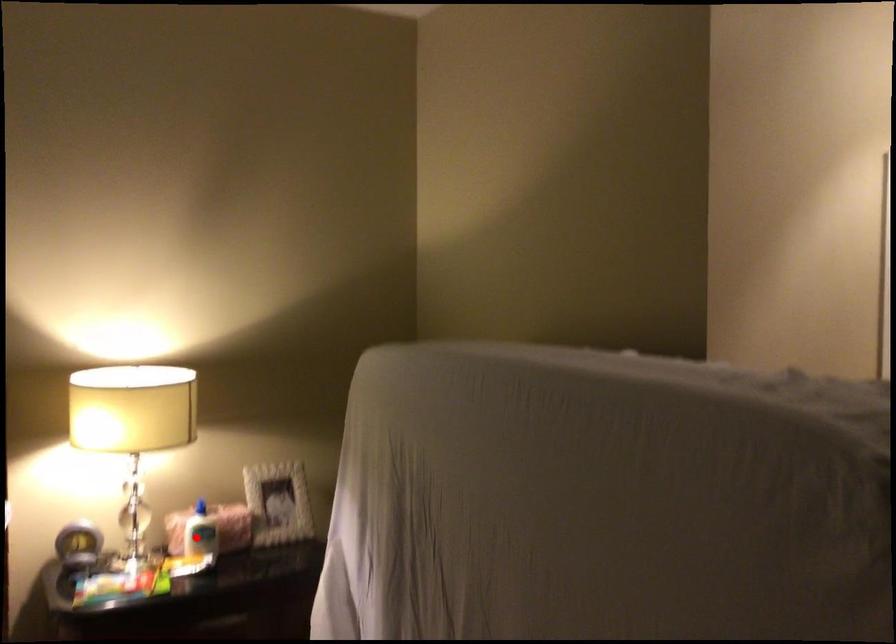
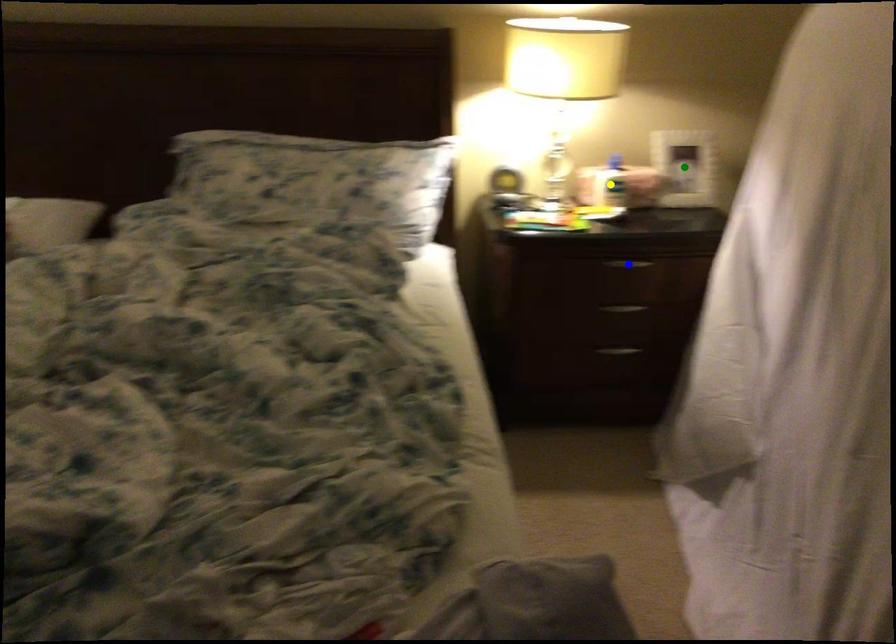
Question: I am providing you with two images of the same scene from different viewpoints. A red point is marked on the first image. You are given multiple points on the second image. Which spot in image 2 lines up with the point in image 1?

Choices:
 (A) blue point
 (B) yellow point
 (C) green point

Answer: (B)